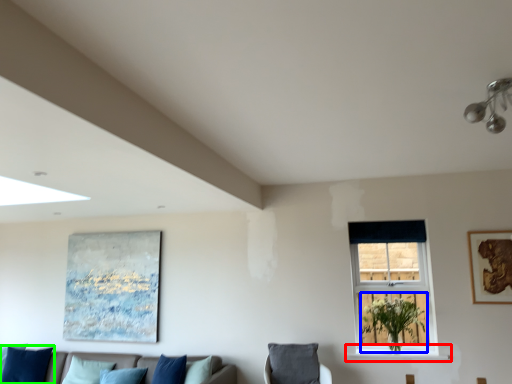
Question: Which object is the farthest from window sill (highlighted by a red box)? Choose among these: plant (highlighted by a blue box) or pillow (highlighted by a green box).

Choices:
 (A) plant
 (B) pillow

Answer: (B)